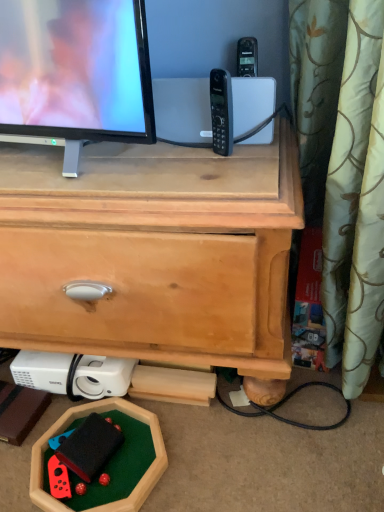
Question: Is rubberized red game controller at lower left taller or shorter than light brown wood chest of drawers at center?

Choices:
 (A) tall
 (B) short

Answer: (B)

Question: From a real-world perspective, is rubberized red game controller at lower left physically located above or below light brown wood chest of drawers at center?

Choices:
 (A) below
 (B) above

Answer: (A)

Question: Estimate the real-world distances between objects in this image. Which object is closer to the rubberized red game controller at lower left?

Choices:
 (A) black plastic phone at center
 (B) light brown wood chest of drawers at center

Answer: (B)

Question: Which of these objects is positioned farthest from the black plastic phone at center?

Choices:
 (A) rubberized red game controller at lower left
 (B) light brown wood chest of drawers at center

Answer: (A)